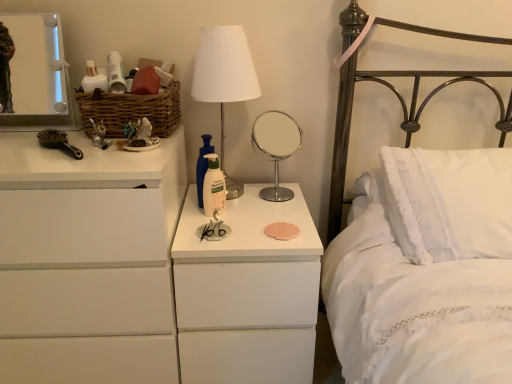
Find the location of a particular element. This screenshot has width=512, height=384. vacant point above white glossy nightstand at center (from a real-world perspective) is located at coordinates (236, 221).